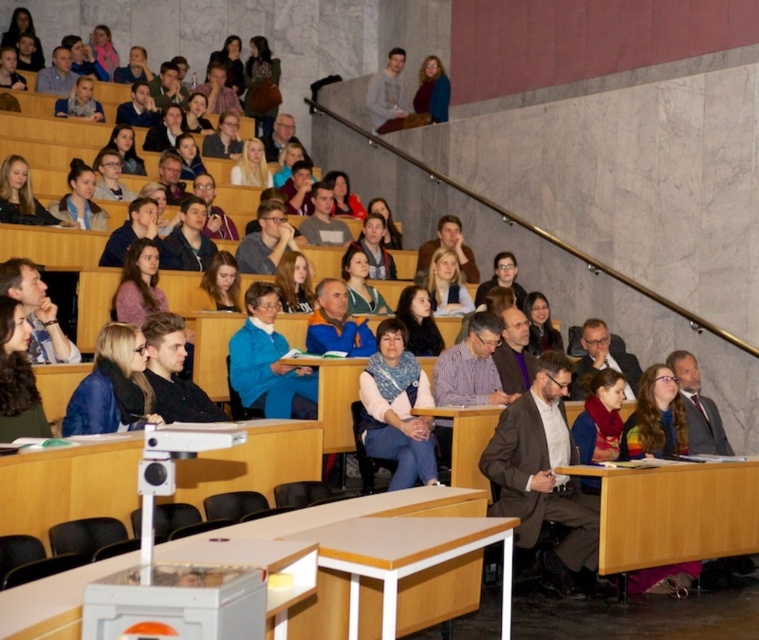
Is point (134, 413) closer to viewer compared to point (509, 252)?

Yes, point (134, 413) is closer to viewer.

Does blue fabric jacket at center have a larger size compared to matte blue sweater at center?

No, blue fabric jacket at center is not bigger than matte blue sweater at center.

The image size is (759, 640). I want to click on blue fabric jacket at center, so click(x=112, y=387).

Which is more to the right, blue fabric sweater at center or matte blue sweater at center?

Positioned to the right is matte blue sweater at center.

Image resolution: width=759 pixels, height=640 pixels. Identify the location of blue fabric sweater at center. (268, 362).

Image resolution: width=759 pixels, height=640 pixels. I want to click on blue fabric sweater at center, so click(x=268, y=362).

The width and height of the screenshot is (759, 640). What do you see at coordinates (268, 362) in the screenshot?
I see `blue fabric sweater at center` at bounding box center [268, 362].

Who is taller, blue fabric sweater at center or blue fabric jacket at center?

blue fabric sweater at center

Locate an element on the screen. blue fabric sweater at center is located at coordinates (268, 362).